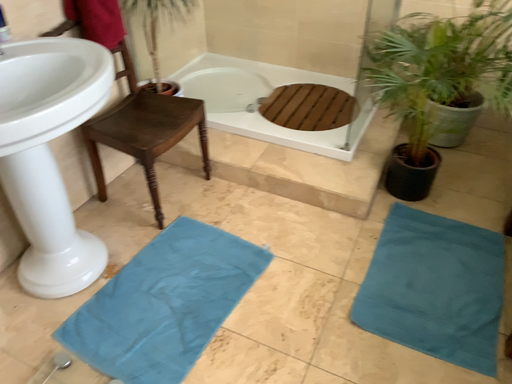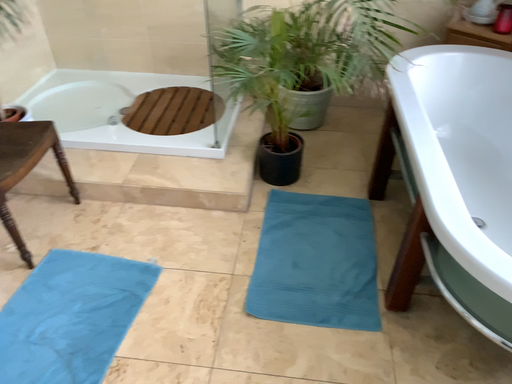
Question: Which way did the camera rotate in the video?

Choices:
 (A) rotated left
 (B) rotated right

Answer: (B)